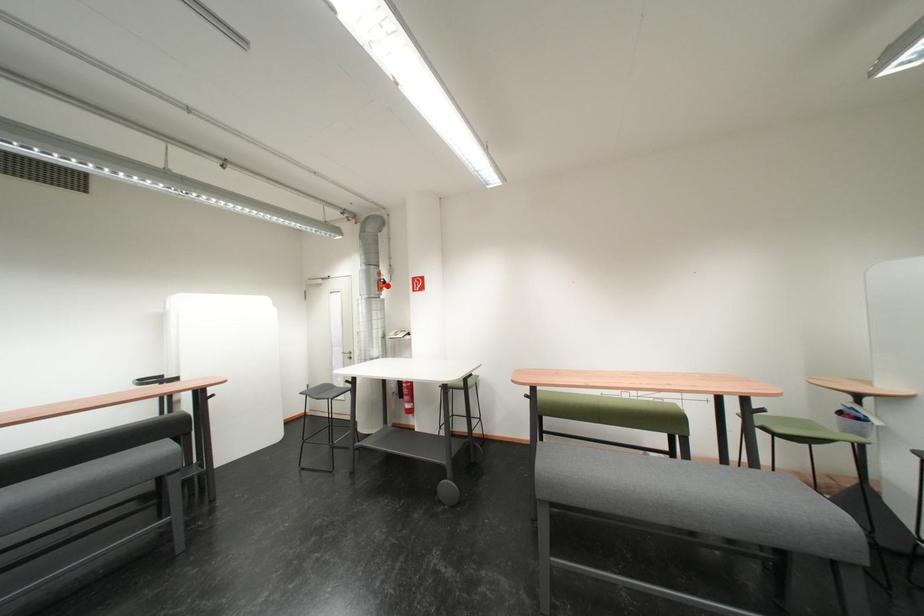
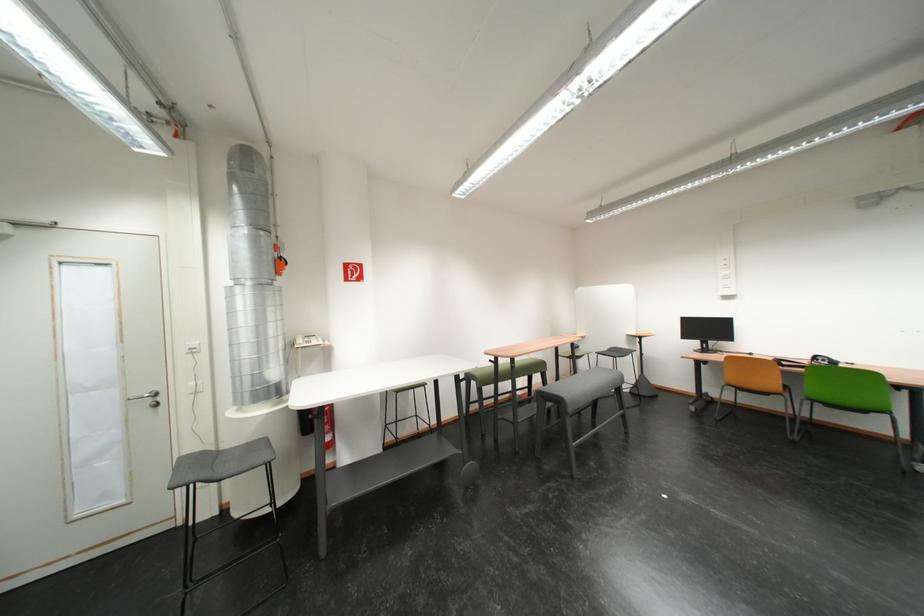
Question: I am providing you with two images of the same scene from different viewpoints. In image1, a red point is highlighted. Considering the same 3D point in image2, which of the following is correct?

Choices:
 (A) It is closer
 (B) It is farther

Answer: (B)